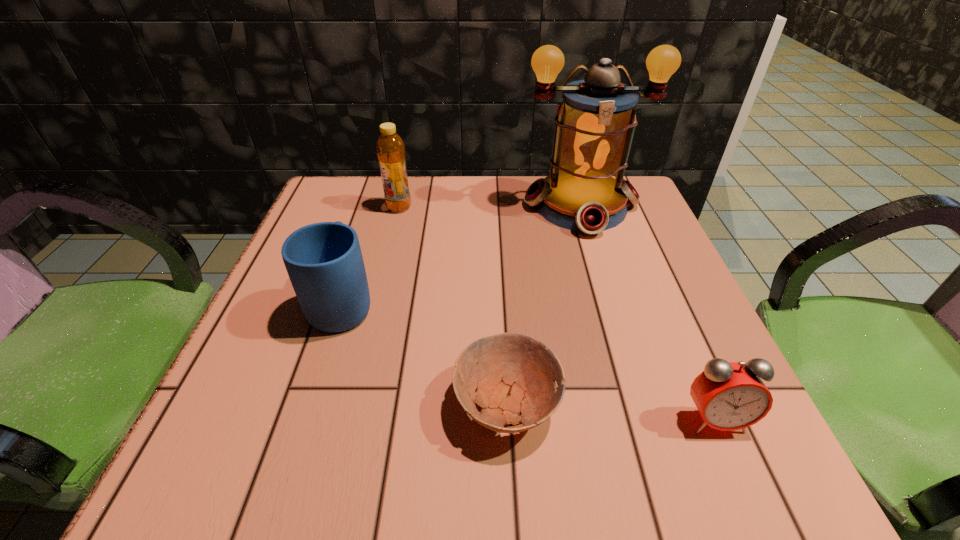
At what (x,y) coordinates should I click in order to perform the action: click on the tallest object. Please return your answer as a coordinate pair (x, y). Looking at the image, I should click on (594, 125).

Find the location of a particular element. the fourth shortest object is located at coordinates (390, 148).

The image size is (960, 540). Identify the location of the third farthest object. (324, 261).

Where is `the third shortest object`? the third shortest object is located at coordinates (324, 261).

Where is `the fourth tallest object`? the fourth tallest object is located at coordinates (729, 396).

What are the coordinates of `bowl` in the screenshot? It's located at (512, 373).

This screenshot has width=960, height=540. In order to click on vacant space located on the front-facing side of the tallest object in this screenshot , I will do `click(630, 366)`.

You are a GUI agent. You are given a task and a screenshot of the screen. Output one action in this format:
    pyautogui.click(x=<x>, y=<y>)
    Task: Click on the vacant region located on the right of the fourth shortest object
    
    Given the screenshot: What is the action you would take?
    pyautogui.click(x=522, y=207)

At what (x,y) coordinates should I click in order to perform the action: click on free space located 0.270m on the side of the third shortest object with the handle. Please return your answer as a coordinate pair (x, y). The width and height of the screenshot is (960, 540). Looking at the image, I should click on (377, 199).

The width and height of the screenshot is (960, 540). In order to click on blank space located on the side of the third shortest object with the handle in this screenshot , I will do (373, 208).